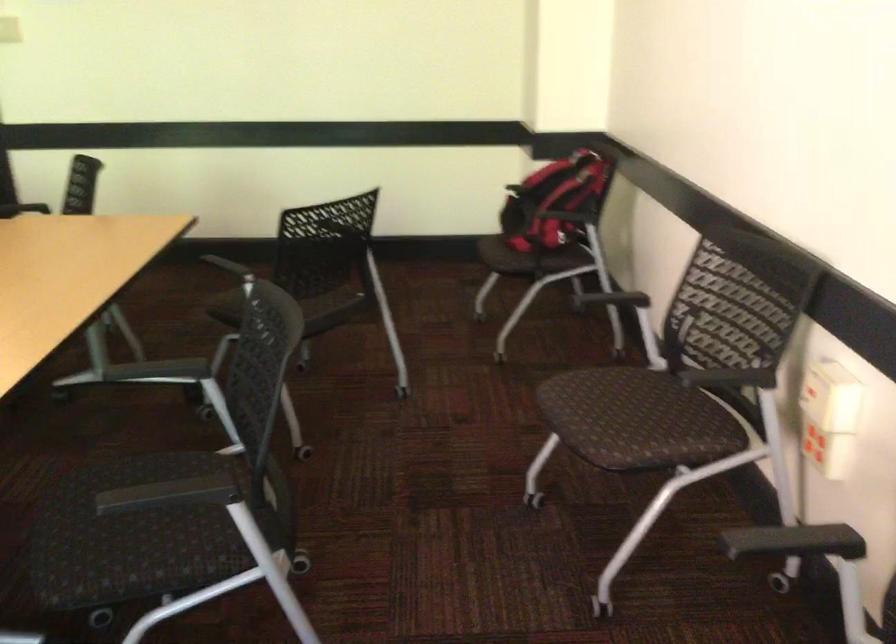
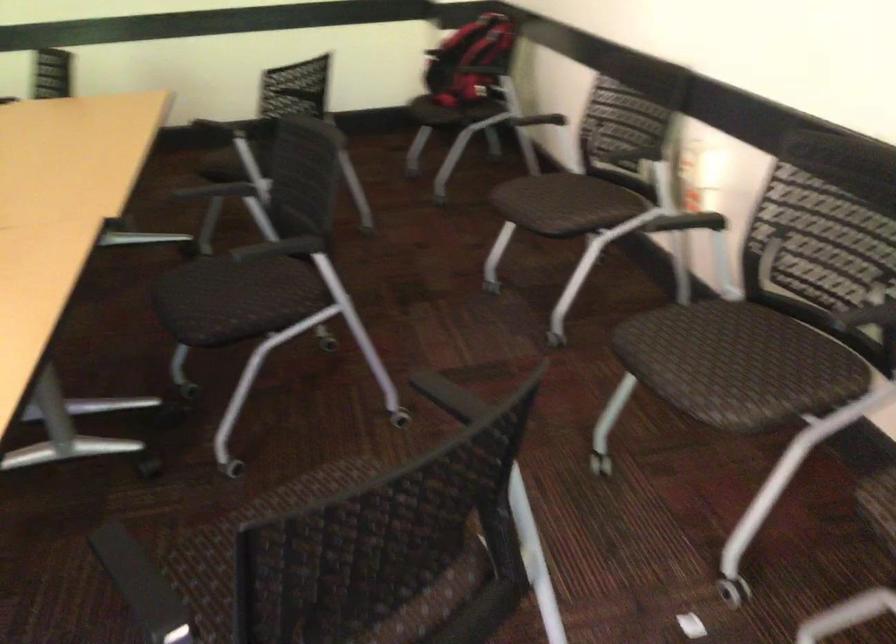
In the second image, find the point that corresponds to (171,370) in the first image.

(216, 189)